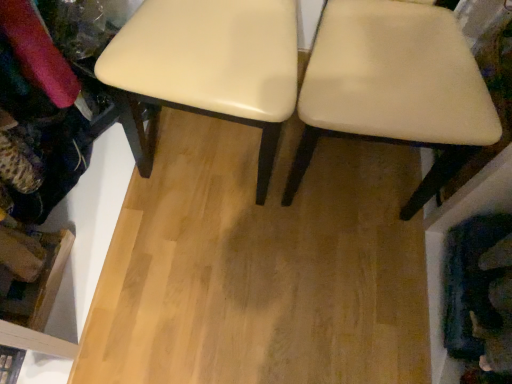
This screenshot has height=384, width=512. Describe the element at coordinates (395, 86) in the screenshot. I see `beige fabric chair at center` at that location.

Locate an element on the screen. beige fabric chair at center is located at coordinates (395, 86).

This screenshot has width=512, height=384. What do you see at coordinates (212, 63) in the screenshot? I see `matte cream stool at center` at bounding box center [212, 63].

In the scene shown: In order to face matte cream stool at center, should I rotate leftwards or rightwards?

Turn left by 5.084 degrees to look at matte cream stool at center.

Identify the location of matte cream stool at center. (212, 63).

Where is `beige fabric chair at center`? This screenshot has height=384, width=512. beige fabric chair at center is located at coordinates (395, 86).

Which object is positioned more to the right, beige fabric chair at center or matte cream stool at center?

beige fabric chair at center.

Looking at this image, relative to matte cream stool at center, is beige fabric chair at center in front or behind?

Clearly, beige fabric chair at center is in front of matte cream stool at center.

Is point (393, 86) positioned before point (169, 81)?

That is False.

From the image's perspective, between beige fabric chair at center and matte cream stool at center, who is located below?

beige fabric chair at center appears lower in the image.

From a real-world perspective, is beige fabric chair at center under matte cream stool at center?

Actually, beige fabric chair at center is physically above matte cream stool at center in the real world.

Looking at their sizes, would you say beige fabric chair at center is wider or thinner than matte cream stool at center?

Considering their sizes, beige fabric chair at center looks slimmer than matte cream stool at center.

Does beige fabric chair at center have a lesser height compared to matte cream stool at center?

No, beige fabric chair at center is not shorter than matte cream stool at center.

Does beige fabric chair at center have a larger size compared to matte cream stool at center?

Correct, beige fabric chair at center is larger in size than matte cream stool at center.

Based on the photo, choose the correct answer: Is beige fabric chair at center inside matte cream stool at center or outside it?

beige fabric chair at center is spatially situated outside matte cream stool at center.

Is beige fabric chair at center with matte cream stool at center?

beige fabric chair at center and matte cream stool at center are not in contact.

Could you tell me if beige fabric chair at center is turned towards matte cream stool at center?

No, beige fabric chair at center is not aimed at matte cream stool at center.

How many degrees apart are the facing directions of beige fabric chair at center and matte cream stool at center?

The facing directions of beige fabric chair at center and matte cream stool at center are 3.35 degrees apart.

Find the location of a particular element. This screenshot has height=384, width=512. stool on the left side of beige fabric chair at center is located at coordinates (212, 63).

Which object is positioned more to the right, matte cream stool at center or beige fabric chair at center?

beige fabric chair at center is more to the right.

Which is behind, matte cream stool at center or beige fabric chair at center?

matte cream stool at center.

Between point (212, 48) and point (442, 123), which one is positioned in front?

Point (442, 123)

From the image's perspective, which one is positioned higher, matte cream stool at center or beige fabric chair at center?

matte cream stool at center appears higher in the image.

From a real-world perspective, which object stands above the other?

In real-world perspective, beige fabric chair at center is above.

Can you confirm if matte cream stool at center is wider than beige fabric chair at center?

Yes.

Which of these two, matte cream stool at center or beige fabric chair at center, stands taller?

beige fabric chair at center is taller.

Which of these two, matte cream stool at center or beige fabric chair at center, is smaller?

matte cream stool at center is smaller.

Would you say matte cream stool at center contains beige fabric chair at center?

Actually, beige fabric chair at center is outside matte cream stool at center.

Does matte cream stool at center touch beige fabric chair at center?

No.

Is matte cream stool at center positioned with its back to beige fabric chair at center?

matte cream stool at center is not turned away from beige fabric chair at center.

The image size is (512, 384). What are the coordinates of `chair lying in front of the matte cream stool at center` in the screenshot? It's located at (395, 86).

Locate an element on the screen. chair that is in front of the matte cream stool at center is located at coordinates (395, 86).

Identify the location of chair on the right of the matte cream stool at center. (395, 86).